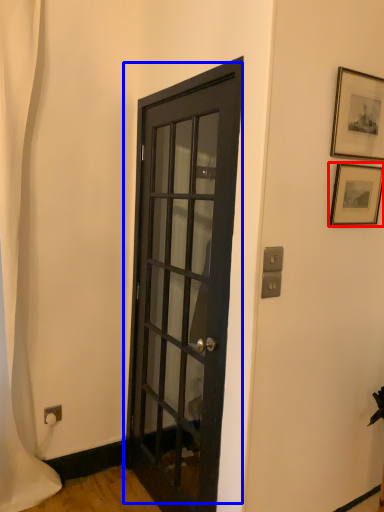
Question: Which of the following is the closest to the observer, picture frame (highlighted by a red box) or door (highlighted by a blue box)?

Choices:
 (A) picture frame
 (B) door

Answer: (B)